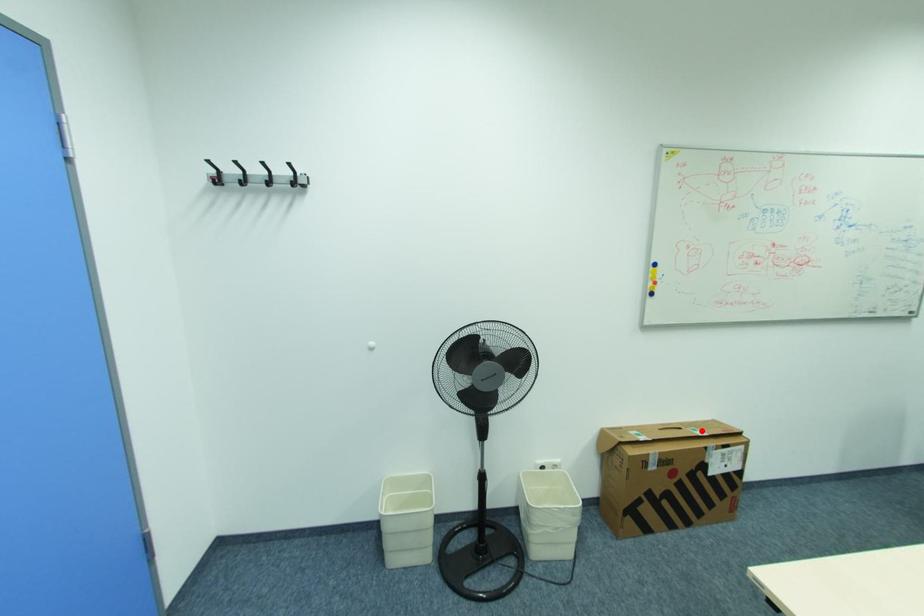
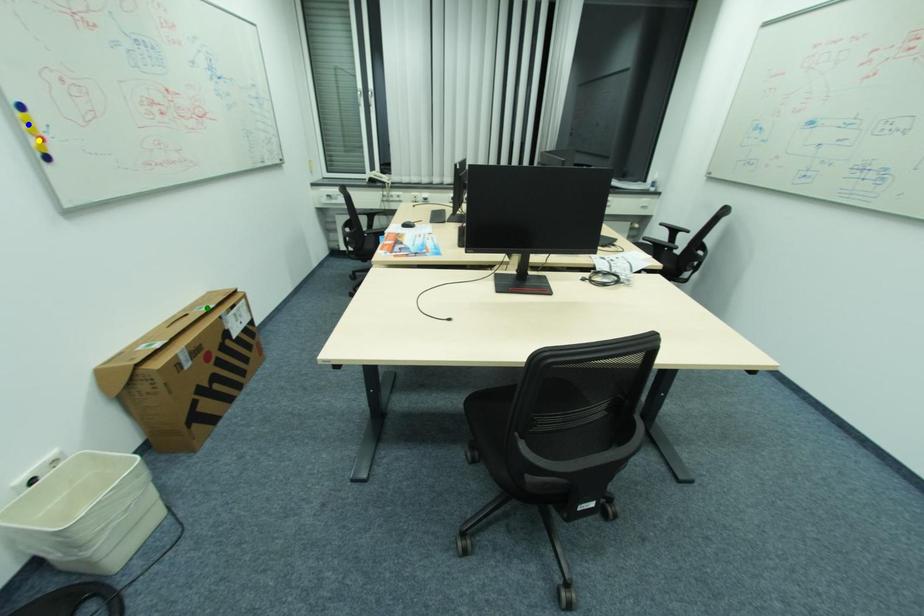
Question: I am providing you with two images of the same scene from different viewpoints. A red point is marked on the first image. You are given multiple points on the second image. Which spot in image 2 lines up with the point in image 1?

Choices:
 (A) blue point
 (B) green point
 (C) yellow point

Answer: (B)